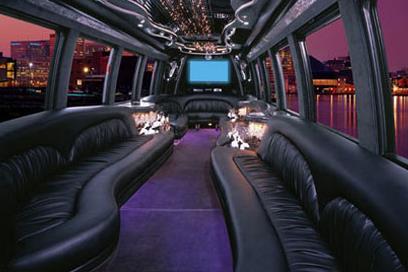
Locate an element on the screen. frame is located at coordinates (372, 113).